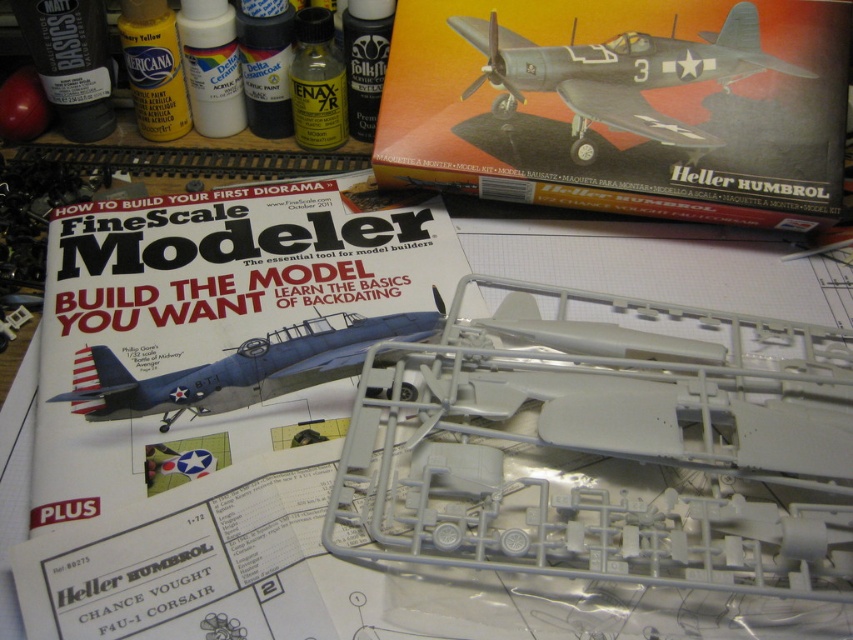
Question: Which point is closer to the camera taking this photo?

Choices:
 (A) click(785, 534)
 (B) click(288, 348)

Answer: (A)

Question: Does white plastic airplane at center have a greater width compared to blue matte airplane at center?

Choices:
 (A) yes
 (B) no

Answer: (A)

Question: Is white plastic airplane at center thinner than blue matte airplane at center?

Choices:
 (A) no
 (B) yes

Answer: (A)

Question: Is white plastic airplane at center bigger than matte gray airplane at upper center?

Choices:
 (A) yes
 (B) no

Answer: (A)

Question: Which is farther from the matte gray airplane at upper center?

Choices:
 (A) blue matte airplane at center
 (B) white plastic airplane at center

Answer: (A)

Question: Which object is the closest to the white plastic airplane at center?

Choices:
 (A) blue matte airplane at center
 (B) matte gray airplane at upper center

Answer: (A)